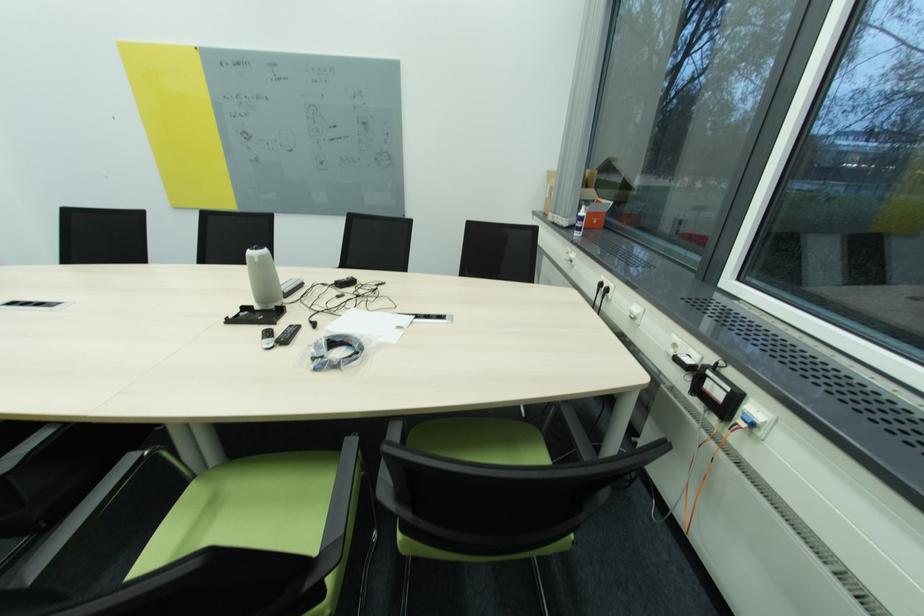
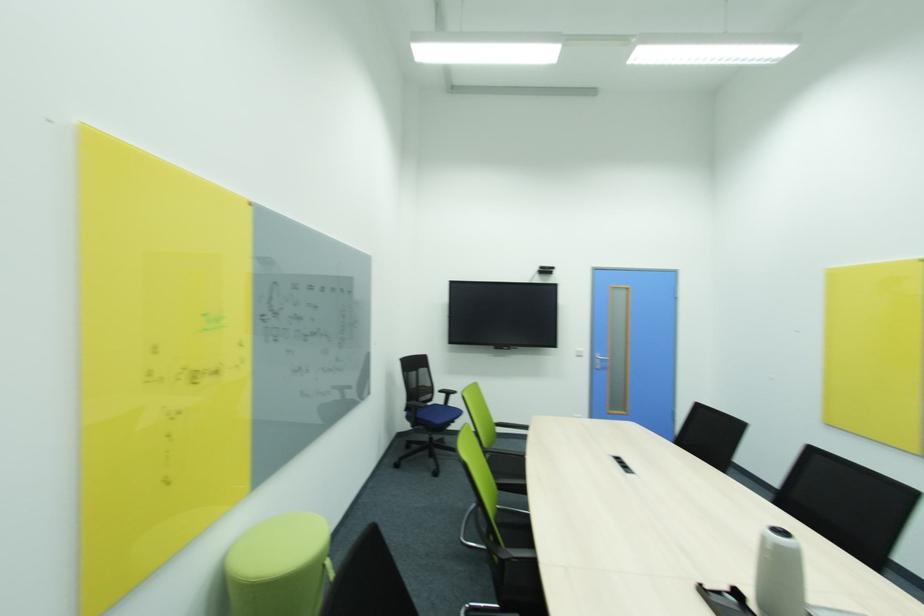
Question: Based on the continuous images, in which direction is the camera rotating? Reply with the corresponding letter.

Choices:
 (A) Left
 (B) Right
 (C) Up
 (D) Down

Answer: (A)